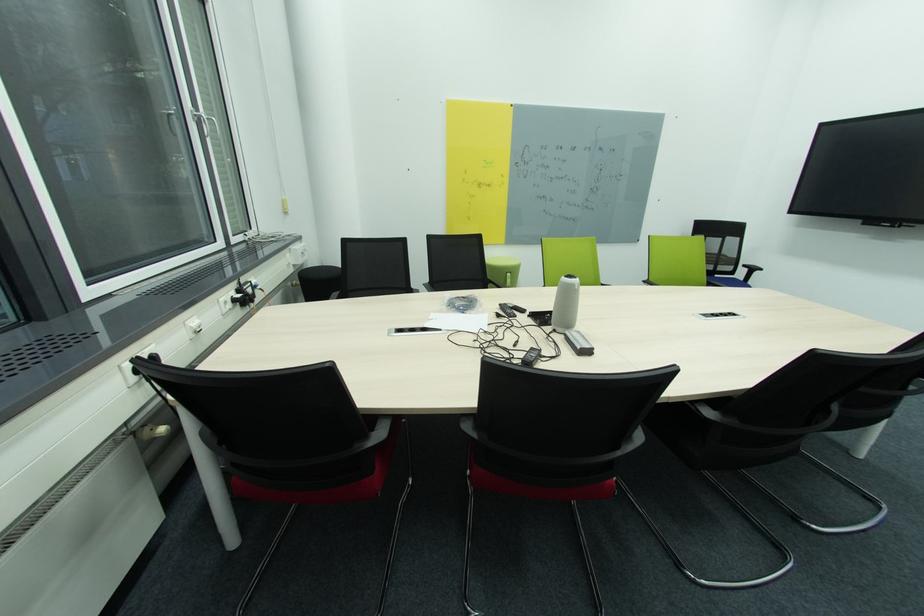
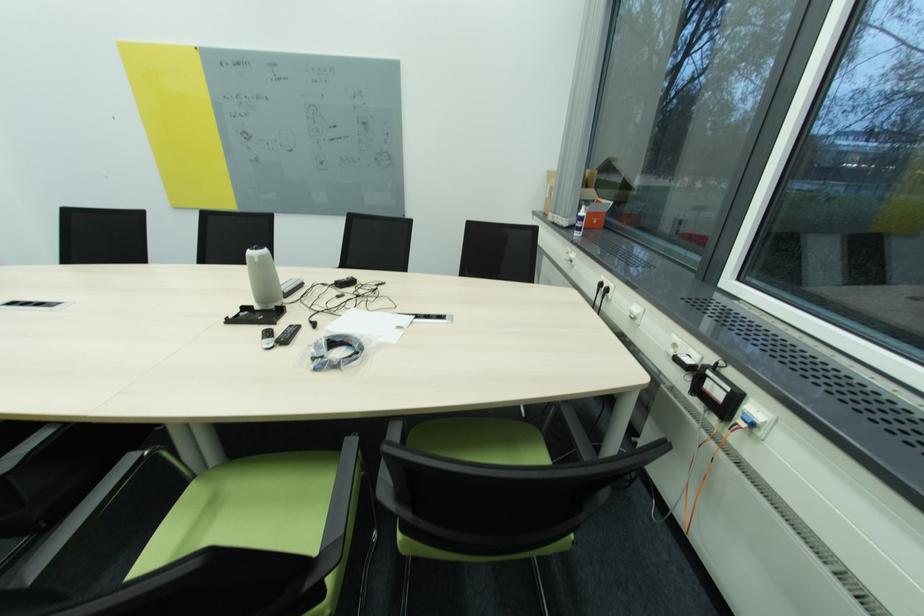
The point at (229,304) is marked in the first image. Where is the corresponding point in the second image?

(679, 346)